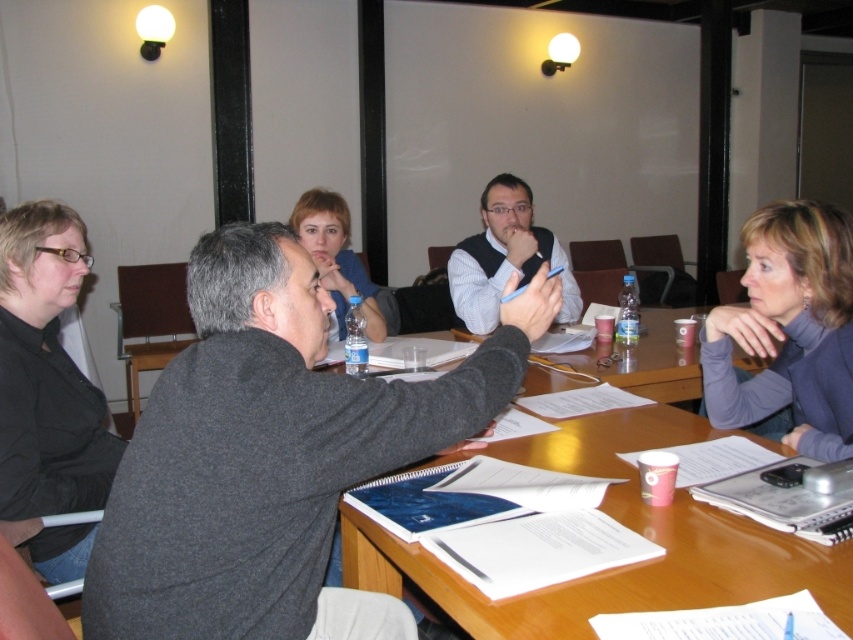
Please look at the point with coordinates (788, 330) in the image. What object is located there?

The purple turtleneck sweater at upper right is located at point (788, 330).

You are organizing a photo shoot and need to place a small prop next to the black matte shirt at lower left and the purple turtleneck sweater at upper right. Since the prop can only fit next to one of them, which person should you choose based on their size?

The black matte shirt at lower left is smaller than the purple turtleneck sweater at upper right, so the prop should be placed next to the purple turtleneck sweater at upper right because it has more space available.

In the scene shown: You are sitting at the rectangular wooden table in the meeting room. You want to pass a document to the person wearing the purple turtleneck sweater at upper right without disturbing the person in the matte blue shirt at center. How can you do this?

You can pass the document to the purple turtleneck sweater at upper right by moving it along the table to the right side of the matte blue shirt at center, since the purple turtleneck sweater at upper right is located to the right of the matte blue shirt at center.